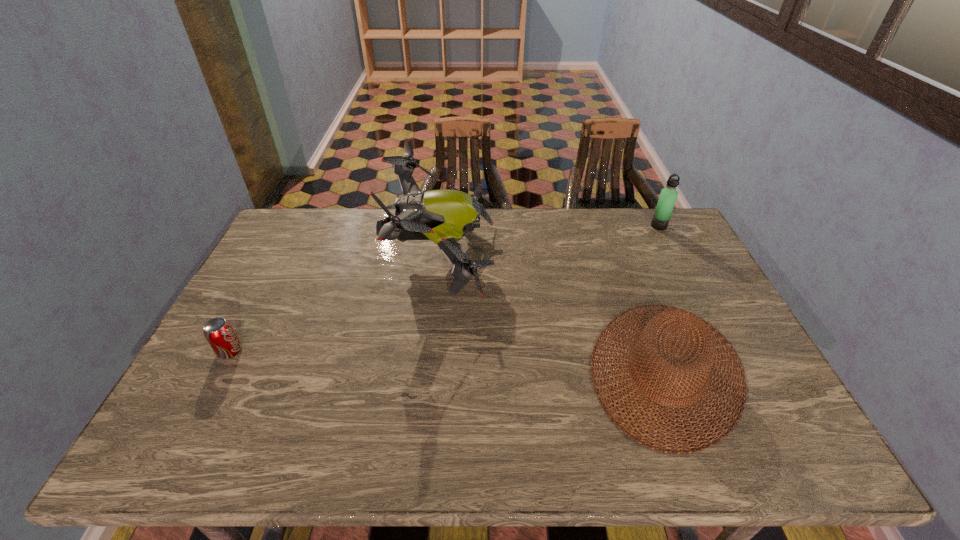
This screenshot has width=960, height=540. Find the location of `drone`. drone is located at coordinates (443, 216).

This screenshot has height=540, width=960. Identify the location of the tallest object. (443, 216).

At what (x,y) coordinates should I click in order to perform the action: click on thermos bottle. Please return your answer as a coordinate pair (x, y). The image size is (960, 540). Looking at the image, I should click on (668, 195).

The height and width of the screenshot is (540, 960). In order to click on the second shortest object in this screenshot , I will do `click(700, 329)`.

The width and height of the screenshot is (960, 540). I want to click on the leftmost object, so click(219, 333).

This screenshot has height=540, width=960. I want to click on soda can, so click(219, 333).

Image resolution: width=960 pixels, height=540 pixels. I want to click on vacant space located 0.270m on the front-facing side of the third object from right to left, so click(x=574, y=256).

This screenshot has width=960, height=540. I want to click on vacant position located 0.100m on the left of the third shortest object, so click(623, 226).

This screenshot has width=960, height=540. I want to click on free space located 0.300m on the back of the sunhat, so click(618, 244).

You are a GUI agent. You are given a task and a screenshot of the screen. Output one action in this format:
    pyautogui.click(x=<x>, y=<y>)
    Task: Click on the vacant space situated 0.130m on the right of the leftmost object
    The height and width of the screenshot is (540, 960).
    Given the screenshot: What is the action you would take?
    pyautogui.click(x=291, y=352)